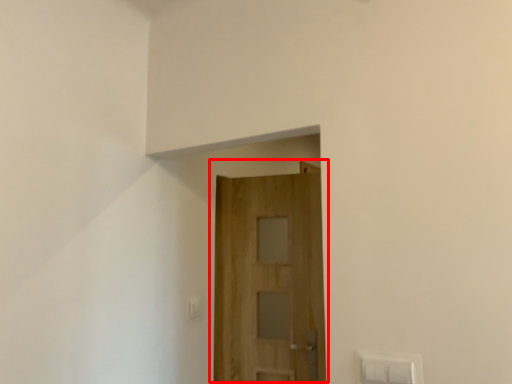
Question: From the image's perspective, considering the relative positions of door (annotated by the red box) and light switch in the image provided, where is door (annotated by the red box) located with respect to the staircase?

Choices:
 (A) above
 (B) below

Answer: (A)